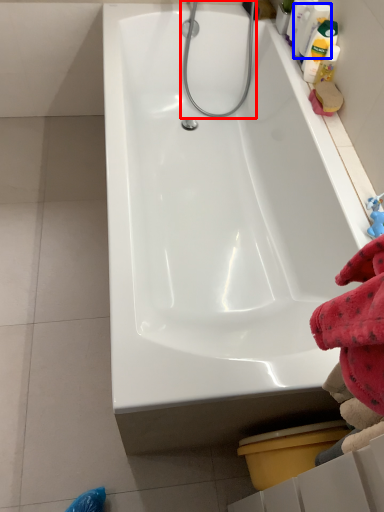
Question: Which object is closer to the camera taking this photo, shower (highlighted by a red box) or cleaning product (highlighted by a blue box)?

Choices:
 (A) shower
 (B) cleaning product

Answer: (B)